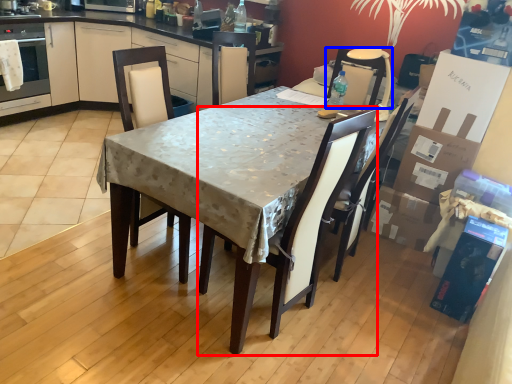
Question: Which object is further to the camera taking this photo, chair (highlighted by a red box) or chair (highlighted by a blue box)?

Choices:
 (A) chair
 (B) chair

Answer: (B)